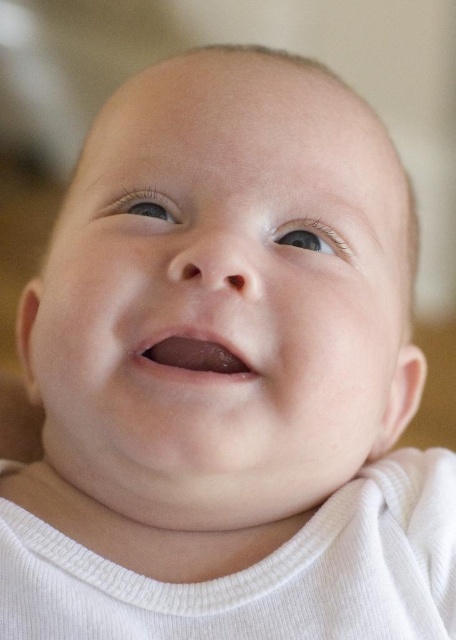
Does white ribbed fabric at center appear under blue smooth eye at upper center?

Indeed, white ribbed fabric at center is positioned under blue smooth eye at upper center.

Can you confirm if white ribbed fabric at center is thinner than blue smooth eye at upper center?

No.

The image size is (456, 640). What do you see at coordinates (259, 572) in the screenshot?
I see `white ribbed fabric at center` at bounding box center [259, 572].

At what (x,y) coordinates should I click in order to perform the action: click on white ribbed fabric at center. Please return your answer as a coordinate pair (x, y). Looking at the image, I should click on (259, 572).

Describe the element at coordinates (191, 355) in the screenshot. I see `smooth pink lips at center` at that location.

Is smooth pink lips at center bigger than blue glossy eye at upper left?

Yes.

You are a GUI agent. You are given a task and a screenshot of the screen. Output one action in this format:
    pyautogui.click(x=<x>, y=<y>)
    Task: Click on the smooth pink lips at center
    The image size is (456, 640).
    Given the screenshot: What is the action you would take?
    pyautogui.click(x=191, y=355)

Between blue smooth eye at upper center and blue glossy eye at upper left, which one has less height?

blue glossy eye at upper left is shorter.

Who is more distant from viewer, (275, 232) or (112, 209)?

Positioned behind is point (112, 209).

Does point (304, 232) come behind point (176, 214)?

Yes, it is.

At what (x,y) coordinates should I click in order to perform the action: click on blue smooth eye at upper center. Please return your answer as a coordinate pair (x, y). Looking at the image, I should click on click(x=312, y=237).